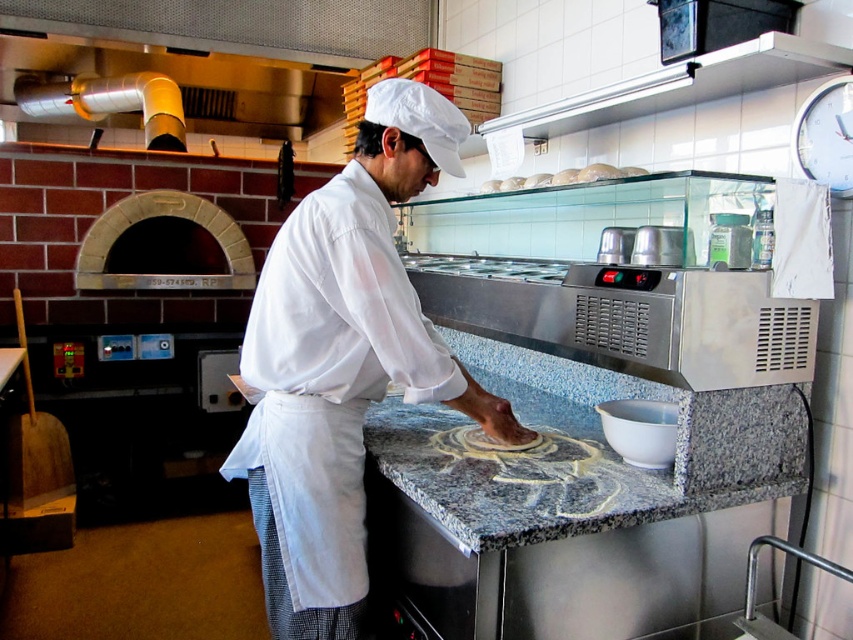
Question: Which point is closer to the camera?

Choices:
 (A) white matte bread at upper center
 (B) white cotton apron at center

Answer: (B)

Question: Which of the following is the closest to the observer?

Choices:
 (A) (355, 572)
 (B) (508, 177)

Answer: (A)

Question: Where is white cotton apron at center located in relation to white matte bread at upper center in the image?

Choices:
 (A) above
 (B) below

Answer: (B)

Question: In this image, where is white cotton apron at center located relative to white matte bread at upper center?

Choices:
 (A) left
 (B) right

Answer: (A)

Question: Is white cotton apron at center bigger than white matte bread at upper center?

Choices:
 (A) yes
 (B) no

Answer: (A)